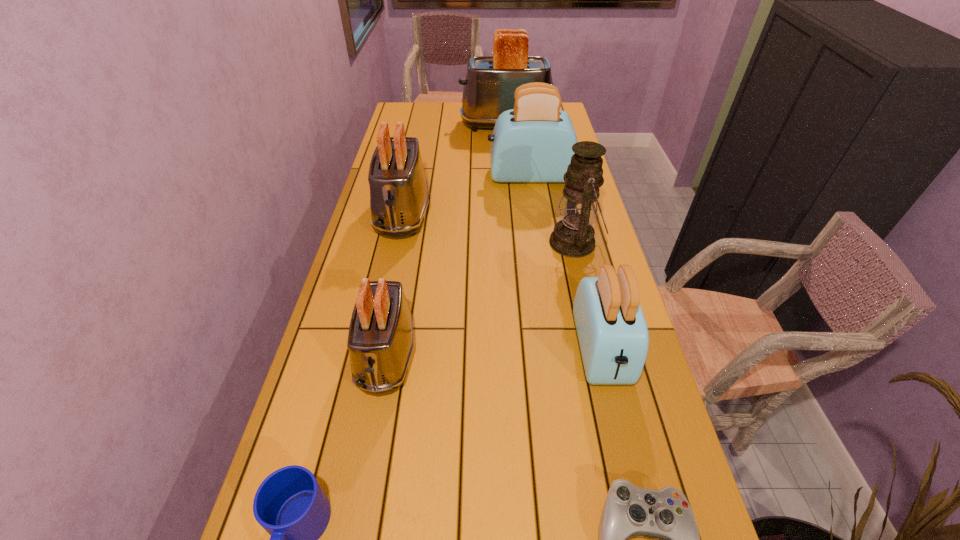
You are a GUI agent. You are given a task and a screenshot of the screen. Output one action in this format:
    pyautogui.click(x=<x>, y=<y>)
    Task: Click on the gray toaster that is the third closest to the bigger light toaster
    The image size is (960, 540).
    Given the screenshot: What is the action you would take?
    pyautogui.click(x=380, y=341)

Image resolution: width=960 pixels, height=540 pixels. Identify the location of gray toaster that is the closest to the bigger light toaster. (399, 196).

The width and height of the screenshot is (960, 540). What are the coordinates of `free space that satisfies the following two spatial constraints: 1. on the side of the bigger light toaster with the lever; 2. on the side of the second nearest gray toaster with the control lever` in the screenshot? It's located at (536, 214).

This screenshot has width=960, height=540. I want to click on blank space that satisfies the following two spatial constraints: 1. on the side of the second smallest gray toaster with the control lever; 2. on the right side of the oil lamp, so click(x=396, y=243).

Find the location of a particular element. free spot that satisfies the following two spatial constraints: 1. on the side of the farthest object with the control lever; 2. on the side of the second nearest gray toaster with the control lever is located at coordinates (515, 214).